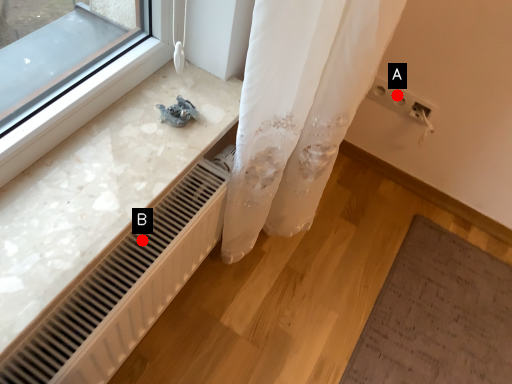
Question: Two points are circled on the image, labeled by A and B beside each circle. Among these points, which one is farthest from the camera?

Choices:
 (A) A is further
 (B) B is further

Answer: (A)